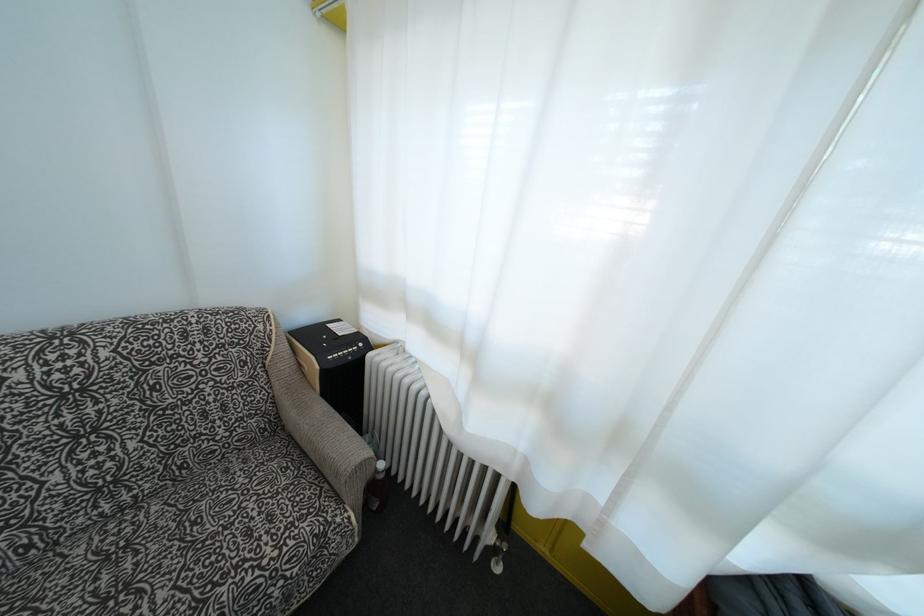
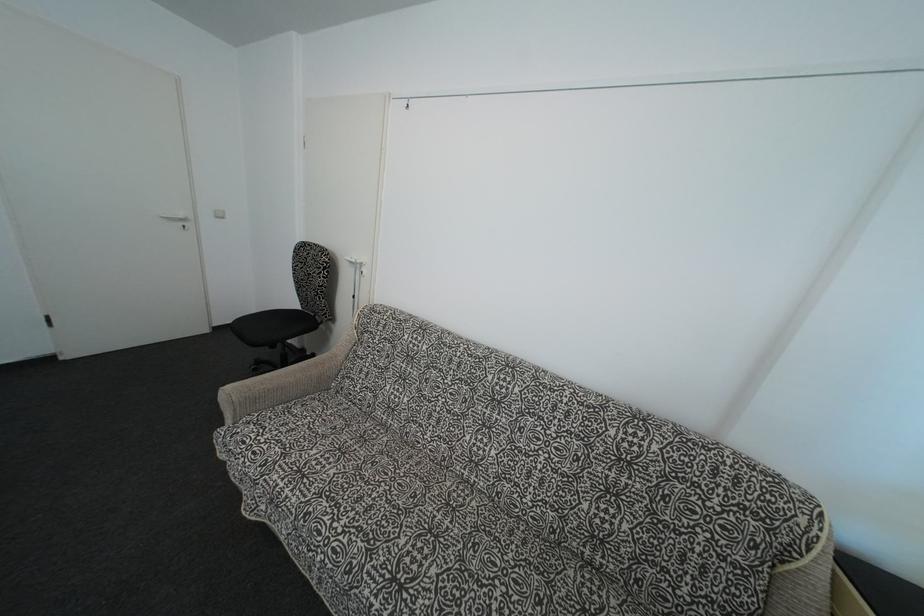
Question: How did the camera likely rotate?

Choices:
 (A) Left
 (B) Right
 (C) Up
 (D) Down

Answer: (A)